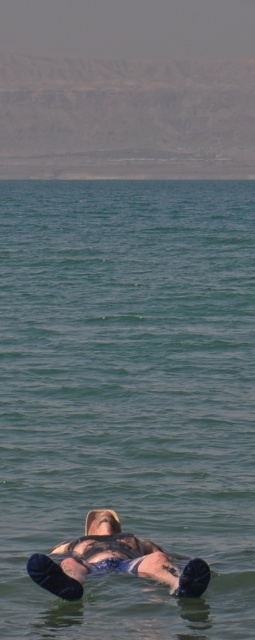
Question: Which point is farther from the camera taking this photo?

Choices:
 (A) (98, 371)
 (B) (96, 561)

Answer: (A)

Question: Is green liquid water at center to the left of blue fabric person at center from the viewer's perspective?

Choices:
 (A) yes
 (B) no

Answer: (B)

Question: Which point is closer to the camera taking this photo?

Choices:
 (A) (148, 368)
 (B) (92, 560)

Answer: (B)

Question: Does green liquid water at center appear on the right side of blue fabric person at center?

Choices:
 (A) no
 (B) yes

Answer: (B)

Question: Does green liquid water at center have a larger size compared to blue fabric person at center?

Choices:
 (A) no
 (B) yes

Answer: (B)